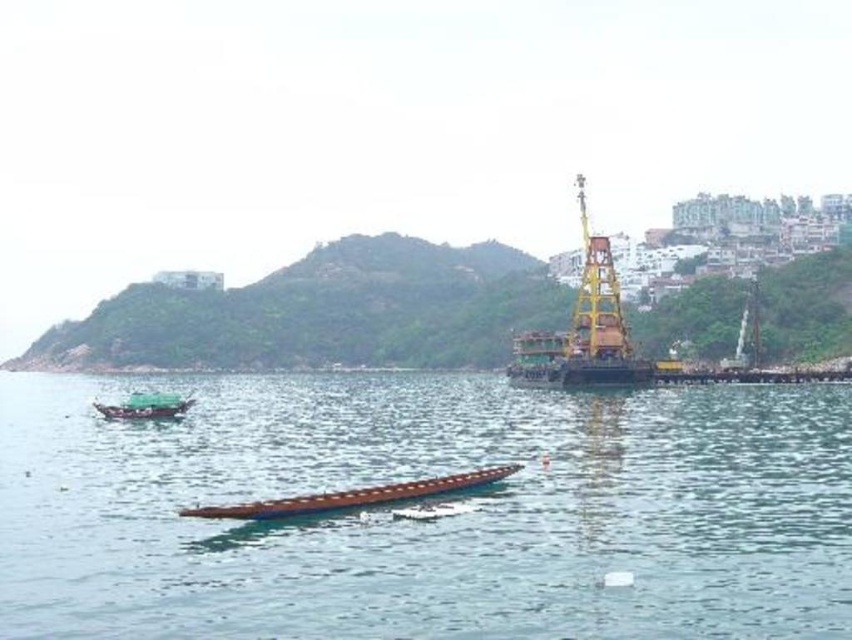
Is brown wooden plank at center closer to camera compared to brown wooden canoe at center?

That is True.

Can you confirm if brown wooden plank at center is positioned to the left of brown wooden canoe at center?

Indeed, brown wooden plank at center is positioned on the left side of brown wooden canoe at center.

Find the location of a particular element. This screenshot has height=640, width=852. brown wooden plank at center is located at coordinates (426, 513).

You are a GUI agent. You are given a task and a screenshot of the screen. Output one action in this format:
    pyautogui.click(x=<x>, y=<y>)
    Task: Click on the brown wooden plank at center
    The width and height of the screenshot is (852, 640).
    Given the screenshot: What is the action you would take?
    pyautogui.click(x=426, y=513)

Is point (173, 339) positioned in front of point (151, 403)?

No, it is not.

Between green grassy hillside at upper center and green matte boat at left, which one is positioned higher?

green grassy hillside at upper center

I want to click on green grassy hillside at upper center, so click(325, 312).

What are the coordinates of `green grassy hillside at upper center` in the screenshot? It's located at (325, 312).

The height and width of the screenshot is (640, 852). What are the coordinates of `brown wooden plank at center` in the screenshot? It's located at tap(426, 513).